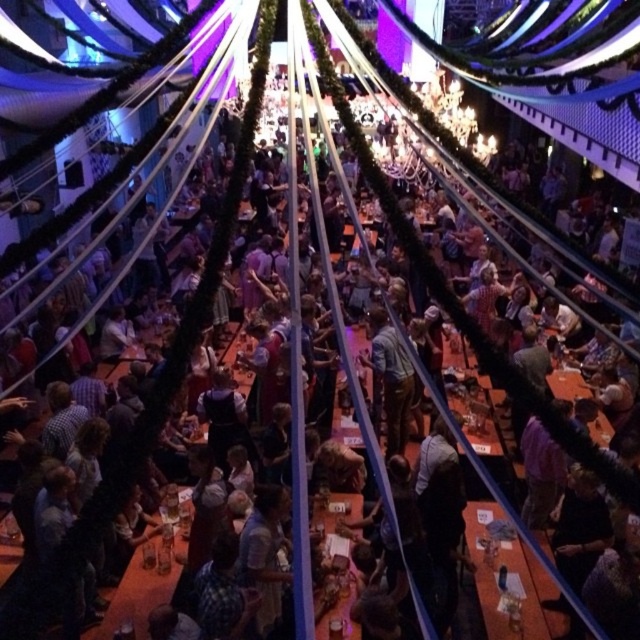
This screenshot has width=640, height=640. Describe the element at coordinates (508, 579) in the screenshot. I see `wooden table at lower right` at that location.

Between point (518, 563) and point (355, 499), which one is positioned in front?

Point (518, 563)

This screenshot has height=640, width=640. What do you see at coordinates (508, 579) in the screenshot?
I see `wooden table at lower right` at bounding box center [508, 579].

You are a GUI agent. You are given a task and a screenshot of the screen. Output one action in this format:
    pyautogui.click(x=<x>, y=<y>)
    Task: Click on the wooden table at lower right
    This screenshot has height=640, width=640.
    Given the screenshot: What is the action you would take?
    pyautogui.click(x=508, y=579)